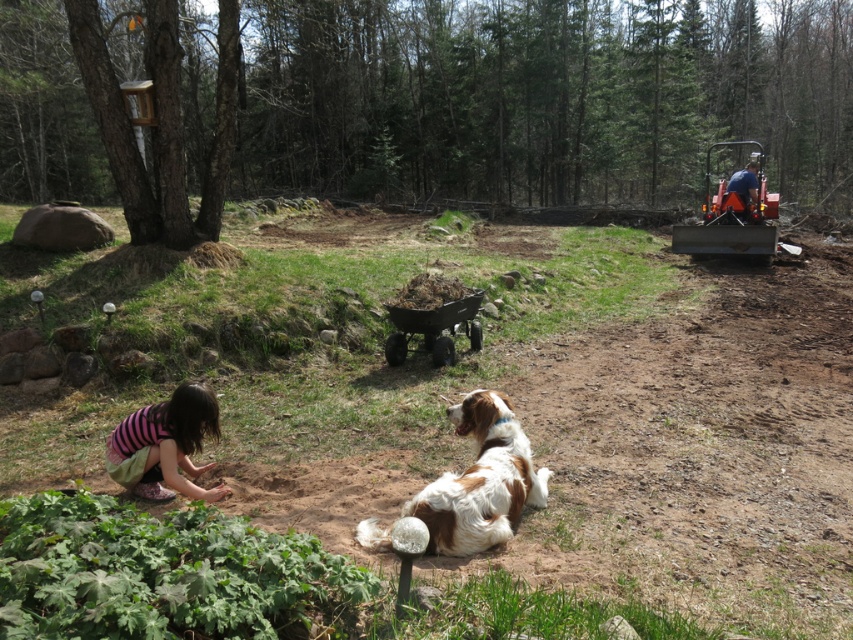
Which is more to the right, striped fabric child at lower left or blue fabric at upper right?

blue fabric at upper right

Does striped fabric child at lower left lie behind blue fabric at upper right?

No.

I want to click on striped fabric child at lower left, so click(166, 444).

Between brown and white fur at center and striped fabric child at lower left, which one is positioned lower?

brown and white fur at center is below.

The image size is (853, 640). Describe the element at coordinates (480, 481) in the screenshot. I see `brown and white fur at center` at that location.

Image resolution: width=853 pixels, height=640 pixels. In order to click on brown and white fur at center in this screenshot , I will do `click(480, 481)`.

Is point (479, 497) more distant than point (737, 173)?

No.

Can you confirm if brown and white fur at center is wider than blue fabric at upper right?

In fact, brown and white fur at center might be narrower than blue fabric at upper right.

Does point (483, 445) lie behind point (743, 202)?

No, (483, 445) is closer to viewer.

Where is `brown and white fur at center`? The image size is (853, 640). brown and white fur at center is located at coordinates (480, 481).